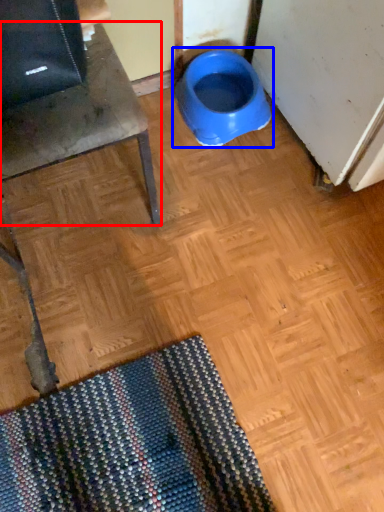
Question: Which point is closer to the camera, furniture (highlighted by a red box) or toilet (highlighted by a blue box)?

Choices:
 (A) furniture
 (B) toilet

Answer: (A)